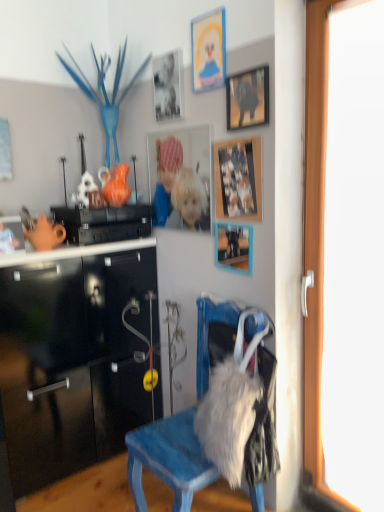
What do you see at coordinates (228, 417) in the screenshot?
I see `fuzzy white coat at lower right` at bounding box center [228, 417].

Identify the location of matte black picture frame at upper center, which is counted as the 4th picture frame, starting from the bottom. Image resolution: width=384 pixels, height=512 pixels. (248, 98).

This screenshot has width=384, height=512. What do you see at coordinates (234, 247) in the screenshot? I see `matte black picture frame at center, positioned as the 6th picture frame in top-to-bottom order` at bounding box center [234, 247].

The width and height of the screenshot is (384, 512). What do you see at coordinates (169, 459) in the screenshot? I see `blue painted wood chair at center` at bounding box center [169, 459].

This screenshot has width=384, height=512. Find the location of `matte silver photo frame at upper center, the 5th picture frame when ordered from bottom to top`. matte silver photo frame at upper center, the 5th picture frame when ordered from bottom to top is located at coordinates (168, 85).

Considering the points (242, 90) and (200, 40), which point is in front, point (242, 90) or point (200, 40)?

The point (242, 90) is more forward.

Is matte black picture frame at upper center, acting as the third picture frame starting from the top, placed right next to matte cardboard picture frame at upper center, arranged as the 1th picture frame when viewed from the top?

matte black picture frame at upper center, acting as the third picture frame starting from the top, is not next to matte cardboard picture frame at upper center, arranged as the 1th picture frame when viewed from the top, and they're not touching.

Who is shorter, matte black picture frame at upper center, acting as the third picture frame starting from the top, or matte cardboard picture frame at upper center, arranged as the sixth picture frame when ordered from the bottom?

With less height is matte black picture frame at upper center, acting as the third picture frame starting from the top.

Based on the photo, is matte black picture frame at upper center, which is counted as the 4th picture frame, starting from the bottom, bigger than matte cardboard picture frame at upper center, arranged as the sixth picture frame when ordered from the bottom?

Indeed, matte black picture frame at upper center, which is counted as the 4th picture frame, starting from the bottom, has a larger size compared to matte cardboard picture frame at upper center, arranged as the sixth picture frame when ordered from the bottom.

Considering the points (69, 214) and (178, 65), which point is behind, point (69, 214) or point (178, 65)?

The point (69, 214) is more distant.

From the image's perspective, between black glossy cabinet at upper left and matte silver photo frame at upper center, the second picture frame from the top, which one is located above?

matte silver photo frame at upper center, the second picture frame from the top, appears higher in the image.

Considering the sizes of black glossy cabinet at upper left and matte silver photo frame at upper center, the 5th picture frame when ordered from bottom to top, in the image, is black glossy cabinet at upper left bigger or smaller than matte silver photo frame at upper center, the 5th picture frame when ordered from bottom to top,?

Clearly, black glossy cabinet at upper left is larger in size than matte silver photo frame at upper center, the 5th picture frame when ordered from bottom to top.

In terms of height, does black glossy cabinet at upper left look taller or shorter compared to matte silver photo frame at upper center, the 5th picture frame when ordered from bottom to top?

Considering their sizes, black glossy cabinet at upper left has less height than matte silver photo frame at upper center, the 5th picture frame when ordered from bottom to top.

Find the location of a particular element. chair below the matte silver photo frame at upper center, the 5th picture frame when ordered from bottom to top (from the image's perspective) is located at coordinates (169, 459).

Which is correct: matte silver photo frame at upper center, the 5th picture frame when ordered from bottom to top, is inside blue painted wood chair at center, or outside of it?

matte silver photo frame at upper center, the 5th picture frame when ordered from bottom to top, is spatially situated outside blue painted wood chair at center.

Could you tell me if matte silver photo frame at upper center, the second picture frame from the top, is facing blue painted wood chair at center?

No, matte silver photo frame at upper center, the second picture frame from the top, is not aimed at blue painted wood chair at center.

From a real-world perspective, is matte silver photo frame at upper center, the 5th picture frame when ordered from bottom to top, physically located above or below blue painted wood chair at center?

matte silver photo frame at upper center, the 5th picture frame when ordered from bottom to top, is above blue painted wood chair at center.

From a real-world perspective, is blue painted wood chair at center positioned above or below matte silver photo frame at upper center, the second picture frame from the top?

From a real-world perspective, blue painted wood chair at center is physically below matte silver photo frame at upper center, the second picture frame from the top.

How many degrees apart are the facing directions of blue painted wood chair at center and matte silver photo frame at upper center, the 5th picture frame when ordered from bottom to top?

The angular difference between blue painted wood chair at center and matte silver photo frame at upper center, the 5th picture frame when ordered from bottom to top, is 1.64 degrees.

Considering the relative sizes of blue painted wood chair at center and matte silver photo frame at upper center, the 5th picture frame when ordered from bottom to top, in the image provided, is blue painted wood chair at center shorter than matte silver photo frame at upper center, the 5th picture frame when ordered from bottom to top,?

No, blue painted wood chair at center is not shorter than matte silver photo frame at upper center, the 5th picture frame when ordered from bottom to top.

Is blue painted wood chair at center beside matte silver photo frame at upper center, the 5th picture frame when ordered from bottom to top?

No, blue painted wood chair at center is not with matte silver photo frame at upper center, the 5th picture frame when ordered from bottom to top.

In the scene shown: How different are the orientations of transparent glass door at right and matte black picture frame at upper center, which is counted as the 4th picture frame, starting from the bottom, in degrees?

The facing directions of transparent glass door at right and matte black picture frame at upper center, which is counted as the 4th picture frame, starting from the bottom, are 0.734 degrees apart.

Which is more to the left, transparent glass door at right or matte black picture frame at upper center, which is counted as the 4th picture frame, starting from the bottom?

From the viewer's perspective, matte black picture frame at upper center, which is counted as the 4th picture frame, starting from the bottom, appears more on the left side.

From the image's perspective, is transparent glass door at right above matte black picture frame at upper center, which is counted as the 4th picture frame, starting from the bottom?

No, from the image's perspective, transparent glass door at right is not on top of matte black picture frame at upper center, which is counted as the 4th picture frame, starting from the bottom.

Which is farther from the camera, (84, 221) or (207, 26)?

Point (84, 221)

Does black glossy cabinet at upper left have a larger size compared to matte cardboard picture frame at upper center, arranged as the 1th picture frame when viewed from the top?

Indeed, black glossy cabinet at upper left has a larger size compared to matte cardboard picture frame at upper center, arranged as the 1th picture frame when viewed from the top.

Is black glossy cabinet at upper left next to matte cardboard picture frame at upper center, arranged as the sixth picture frame when ordered from the bottom, and touching it?

No, black glossy cabinet at upper left is not next to matte cardboard picture frame at upper center, arranged as the sixth picture frame when ordered from the bottom.

Considering the positions of objects black glossy cabinet at upper left and matte cardboard picture frame at upper center, arranged as the sixth picture frame when ordered from the bottom, in the image provided, who is more to the right, black glossy cabinet at upper left or matte cardboard picture frame at upper center, arranged as the sixth picture frame when ordered from the bottom,?

matte cardboard picture frame at upper center, arranged as the sixth picture frame when ordered from the bottom.

Between transparent glass door at right and matte silver photo frame at upper center, the second picture frame from the top, which one has smaller size?

matte silver photo frame at upper center, the second picture frame from the top.

Locate an element on the screen. picture frame that is the 6th one when counting leftward from the transparent glass door at right is located at coordinates (168, 85).

Choose the correct answer: Is transparent glass door at right inside matte silver photo frame at upper center, the 5th picture frame when ordered from bottom to top, or outside it?

transparent glass door at right is spatially situated outside matte silver photo frame at upper center, the 5th picture frame when ordered from bottom to top.

How many degrees apart are the facing directions of transparent glass door at right and matte silver photo frame at upper center, the second picture frame from the top?

The angular difference between transparent glass door at right and matte silver photo frame at upper center, the second picture frame from the top, is 0.748 degrees.

Where is `the 2nd picture frame in front when counting from the matte cardboard picture frame at upper center, arranged as the sixth picture frame when ordered from the bottom`? The height and width of the screenshot is (512, 384). the 2nd picture frame in front when counting from the matte cardboard picture frame at upper center, arranged as the sixth picture frame when ordered from the bottom is located at coordinates (248, 98).

The image size is (384, 512). I want to click on cabinetry on the left of matte silver photo frame at upper center, the second picture frame from the top, so click(x=104, y=223).

Based on their spatial positions, is fuzzy white coat at lower right or matte black picture frame at center, placed as the first picture frame when sorted from bottom to top, closer to matte cardboard picture frame at upper center, arranged as the 1th picture frame when viewed from the top?

matte black picture frame at center, placed as the first picture frame when sorted from bottom to top, is closer to matte cardboard picture frame at upper center, arranged as the 1th picture frame when viewed from the top.

Which object lies nearer to the anchor point matte black picture frame at upper center, acting as the third picture frame starting from the top, fuzzy white coat at lower right or blue painted wood chair at center?

blue painted wood chair at center is closer to matte black picture frame at upper center, acting as the third picture frame starting from the top.

Considering their positions, is matte cardboard picture frame at upper center, arranged as the 1th picture frame when viewed from the top, positioned closer to matte black picture frame at upper center, which is counted as the 4th picture frame, starting from the bottom, than fuzzy white coat at lower right?

matte cardboard picture frame at upper center, arranged as the 1th picture frame when viewed from the top, is positioned closer to the anchor matte black picture frame at upper center, which is counted as the 4th picture frame, starting from the bottom.

When comparing their distances from matte black picture frame at upper center, which is counted as the 4th picture frame, starting from the bottom, does fuzzy white coat at lower right or wooden photo frame at upper center, the second picture frame when ordered from bottom to top, seem closer?

Among the two, wooden photo frame at upper center, the second picture frame when ordered from bottom to top, is located nearer to matte black picture frame at upper center, which is counted as the 4th picture frame, starting from the bottom.

When comparing their distances from matte black picture frame at upper center, which is counted as the 4th picture frame, starting from the bottom, does blue painted wood chair at center or matte black picture frame at center, placed as the first picture frame when sorted from bottom to top, seem closer?

matte black picture frame at center, placed as the first picture frame when sorted from bottom to top, is closer to matte black picture frame at upper center, which is counted as the 4th picture frame, starting from the bottom.

Considering their positions, is matte silver photo frame at upper center, the 5th picture frame when ordered from bottom to top, positioned further to wooden photo frame at upper center, which is the 5th picture frame in top-to-bottom order, than matte black picture frame at center, placed as the first picture frame when sorted from bottom to top?

Among the two, matte silver photo frame at upper center, the 5th picture frame when ordered from bottom to top, is located further to wooden photo frame at upper center, which is the 5th picture frame in top-to-bottom order.

Considering their positions, is transparent glass door at right positioned further to wooden photo frame at upper center, the second picture frame when ordered from bottom to top, than black glossy cabinet at upper left?

black glossy cabinet at upper left lies further to wooden photo frame at upper center, the second picture frame when ordered from bottom to top, than the other object.

From the image, which object appears to be nearer to black glossy cabinet at upper left, matte silver photo frame at upper center, the 5th picture frame when ordered from bottom to top, or wooden photo frame at upper center, which is the 5th picture frame in top-to-bottom order?

Among the two, matte silver photo frame at upper center, the 5th picture frame when ordered from bottom to top, is located nearer to black glossy cabinet at upper left.

Locate an element on the screen. chair between black glossy cabinet at upper left and fuzzy white coat at lower right in the up-down direction is located at coordinates (169, 459).

Identify the location of cabinetry between matte cardboard picture frame at upper center, arranged as the sixth picture frame when ordered from the bottom, and matte black picture frame at center, positioned as the 6th picture frame in top-to-bottom order, vertically. (104, 223).

The image size is (384, 512). What are the coordinates of `screen door between matte black picture frame at upper center, acting as the third picture frame starting from the top, and fuzzy white coat at lower right, in the vertical direction` in the screenshot? It's located at (346, 248).

You are a GUI agent. You are given a task and a screenshot of the screen. Output one action in this format:
    pyautogui.click(x=<x>, y=<y>)
    Task: Click on the screen door between matte plastic picture frame at center, the 3th picture frame positioned from the bottom, and fuzzy white coat at lower right in the up-down direction
    The height and width of the screenshot is (512, 384).
    Given the screenshot: What is the action you would take?
    pyautogui.click(x=346, y=248)